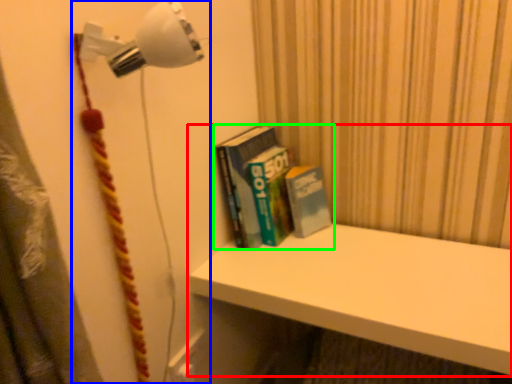
Question: Based on their relative distances, which object is nearer to shelf (highlighted by a red box)? Choose from lamp (highlighted by a blue box) and book (highlighted by a green box).

Choices:
 (A) lamp
 (B) book

Answer: (B)